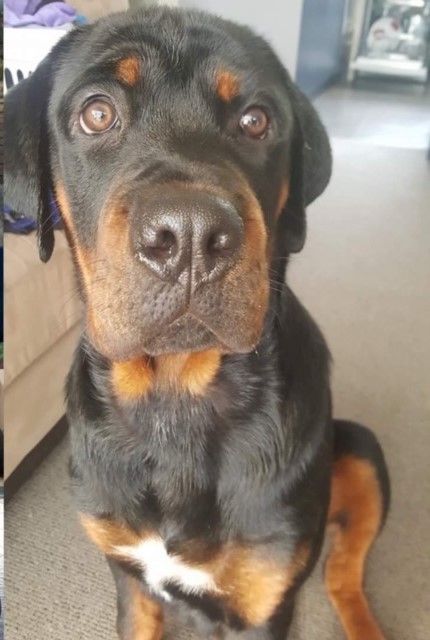
The height and width of the screenshot is (640, 430). Identify the location of sofa. (14, 336).